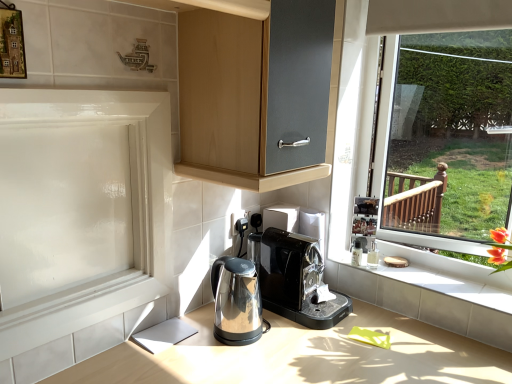
The width and height of the screenshot is (512, 384). In order to click on vacant space in front of black plastic coffee machine at center, marked as the 1th home appliance in a right-to-left arrangement in this screenshot , I will do `click(310, 355)`.